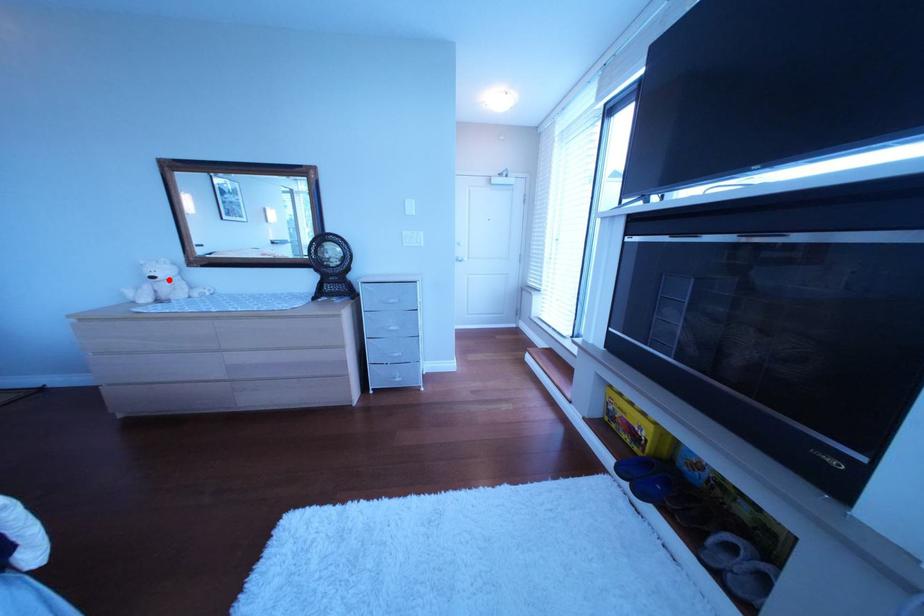
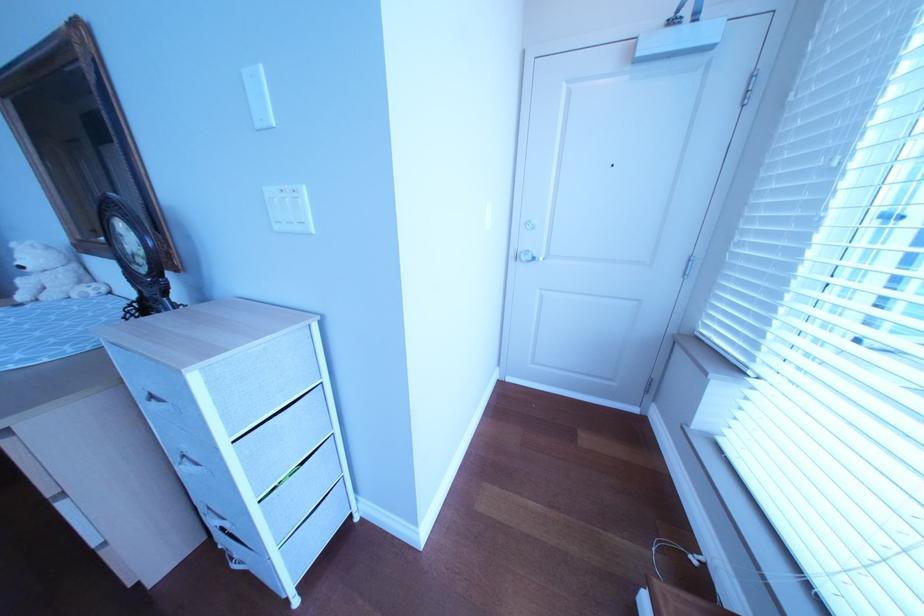
In the second image, find the point that corresponds to the highlighted location in the first image.

(37, 270)